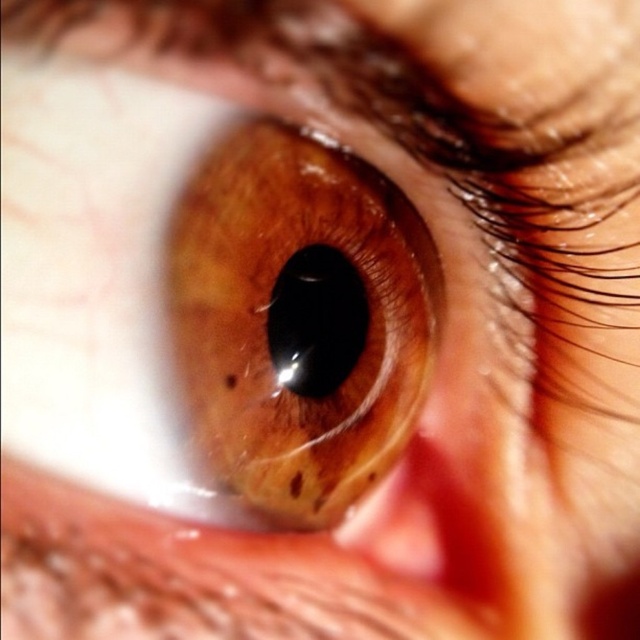
Question: Can you confirm if brown glossy eye at center is positioned below black glossy iris at center?

Choices:
 (A) yes
 (B) no

Answer: (B)

Question: Which point is closer to the camera?

Choices:
 (A) black glossy iris at center
 (B) brown glossy eye at center

Answer: (B)

Question: Can you confirm if brown glossy eye at center is positioned below black glossy iris at center?

Choices:
 (A) yes
 (B) no

Answer: (B)

Question: Does brown glossy eye at center appear over black glossy iris at center?

Choices:
 (A) no
 (B) yes

Answer: (B)

Question: Which object is closer to the camera taking this photo?

Choices:
 (A) brown glossy eye at center
 (B) black glossy iris at center

Answer: (A)